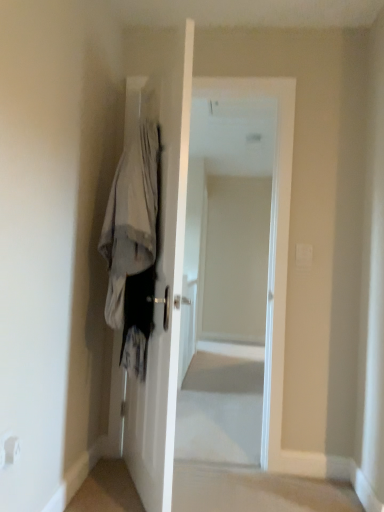
Where is `blank space to the left of white glossy door at center`? The height and width of the screenshot is (512, 384). blank space to the left of white glossy door at center is located at coordinates (110, 489).